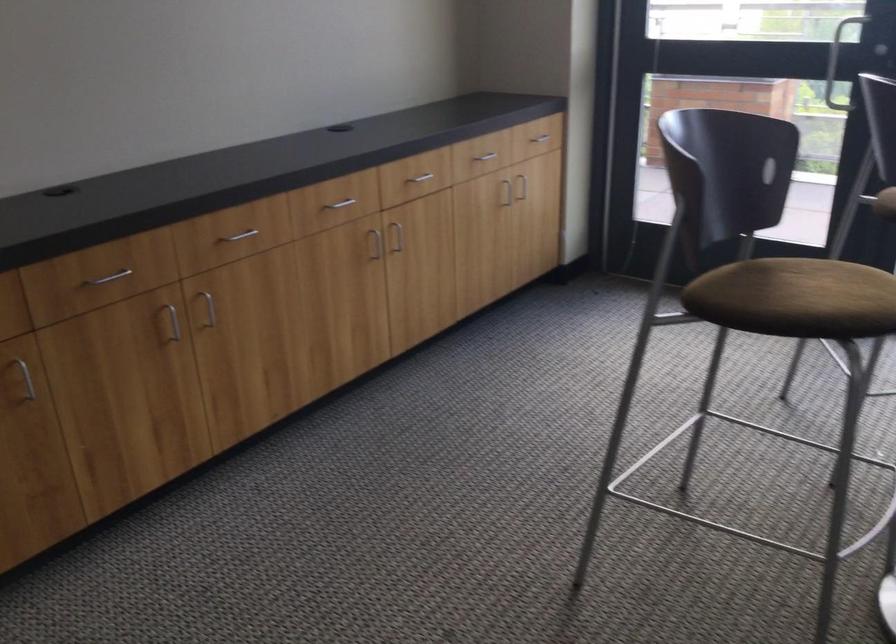
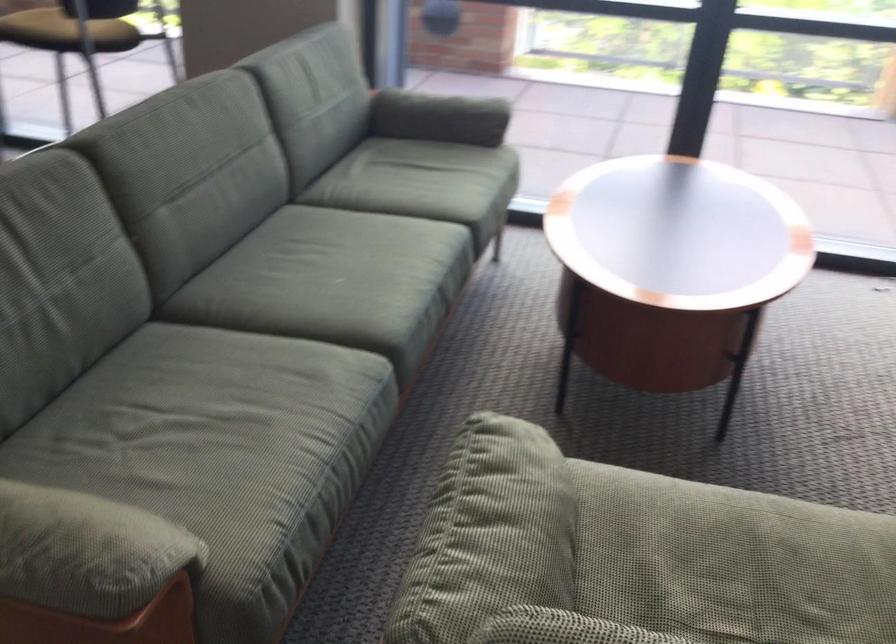
The images are taken continuously from a first-person perspective. In which direction are you moving?

The movement direction of the cameraman is right, backward.